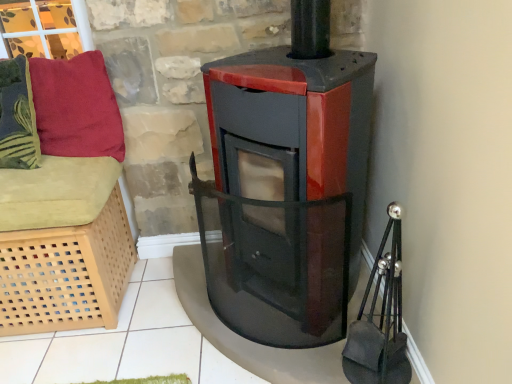
Question: Could you tell me if velvety red pillow at upper left, the 1th pillow viewed from the right, is facing velvety green pillow at left, the 1th pillow when ordered from left to right?

Choices:
 (A) yes
 (B) no

Answer: (B)

Question: Does velvety red pillow at upper left, the 1th pillow viewed from the right, appear on the right side of velvety green pillow at left, the 2th pillow when ordered from right to left?

Choices:
 (A) no
 (B) yes

Answer: (B)

Question: From the image's perspective, is velvety red pillow at upper left, the 1th pillow viewed from the right, beneath velvety green pillow at left, the 1th pillow when ordered from left to right?

Choices:
 (A) yes
 (B) no

Answer: (B)

Question: Does velvety red pillow at upper left, which ranks as the second pillow in left-to-right order, appear on the left side of velvety green pillow at left, the 2th pillow when ordered from right to left?

Choices:
 (A) yes
 (B) no

Answer: (B)

Question: Is velvety red pillow at upper left, the 1th pillow viewed from the right, positioned with its back to velvety green pillow at left, the 2th pillow when ordered from right to left?

Choices:
 (A) yes
 (B) no

Answer: (B)

Question: From the image's perspective, is light wood lattice basket at left located above or below velvety green pillow at left, the 2th pillow when ordered from right to left?

Choices:
 (A) above
 (B) below

Answer: (B)

Question: From a real-world perspective, relative to velvety green pillow at left, the 1th pillow when ordered from left to right, is light wood lattice basket at left vertically above or below?

Choices:
 (A) above
 (B) below

Answer: (B)

Question: Considering the positions of light wood lattice basket at left and velvety green pillow at left, the 2th pillow when ordered from right to left, in the image, is light wood lattice basket at left wider or thinner than velvety green pillow at left, the 2th pillow when ordered from right to left,?

Choices:
 (A) wide
 (B) thin

Answer: (A)

Question: From their relative heights in the image, would you say light wood lattice basket at left is taller or shorter than velvety green pillow at left, the 2th pillow when ordered from right to left?

Choices:
 (A) short
 (B) tall

Answer: (B)

Question: From the image's perspective, is velvety red pillow at upper left, the 1th pillow viewed from the right, positioned above or below light wood lattice basket at left?

Choices:
 (A) above
 (B) below

Answer: (A)

Question: Relative to light wood lattice basket at left, is velvety red pillow at upper left, which ranks as the second pillow in left-to-right order, in front or behind?

Choices:
 (A) front
 (B) behind

Answer: (B)

Question: From their relative heights in the image, would you say velvety red pillow at upper left, the 1th pillow viewed from the right, is taller or shorter than light wood lattice basket at left?

Choices:
 (A) short
 (B) tall

Answer: (A)

Question: Is point (34, 67) closer or farther from the camera than point (102, 309)?

Choices:
 (A) farther
 (B) closer

Answer: (B)

Question: Would you say velvety green pillow at left, the 1th pillow when ordered from left to right, is inside or outside velvety red pillow at upper left, which ranks as the second pillow in left-to-right order?

Choices:
 (A) inside
 (B) outside

Answer: (B)

Question: In the image, is velvety green pillow at left, the 1th pillow when ordered from left to right, positioned in front of or behind velvety red pillow at upper left, which ranks as the second pillow in left-to-right order?

Choices:
 (A) front
 (B) behind

Answer: (A)